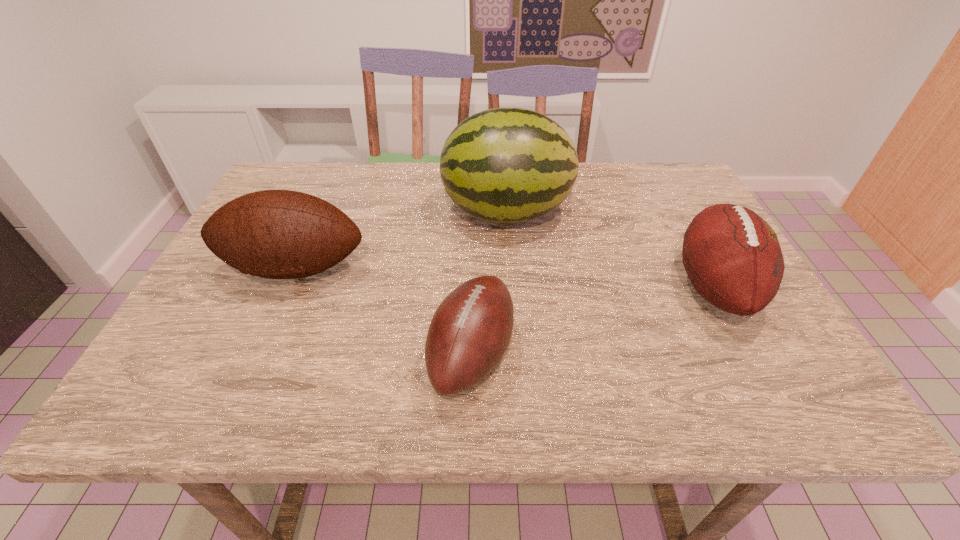
The image size is (960, 540). Find the location of `football (American) that can be found as the second closest to the second football (American) from left to right`. football (American) that can be found as the second closest to the second football (American) from left to right is located at coordinates tap(732, 256).

I want to click on football (American) that is the closest to the tallest object, so click(279, 234).

Identify the location of blank space that satisfies the following two spatial constraints: 1. on the laces of the second football (American) from left to right; 2. on the left side of the leftmost football (American). The height and width of the screenshot is (540, 960). (257, 354).

Where is `vacant space that satisfies the following two spatial constraints: 1. at the stem end of the tallest object; 2. on the laces of the leftmost object`? vacant space that satisfies the following two spatial constraints: 1. at the stem end of the tallest object; 2. on the laces of the leftmost object is located at coordinates (511, 268).

Locate an element on the screen. free spot that satisfies the following two spatial constraints: 1. on the laces of the leftmost object; 2. on the right side of the shortest football (American) is located at coordinates (257, 354).

You are a GUI agent. You are given a task and a screenshot of the screen. Output one action in this format:
    pyautogui.click(x=<x>, y=<y>)
    Task: Click on the free space that satisfies the following two spatial constraints: 1. at the stem end of the rightmost football (American); 2. on the right side of the tallest object
    
    Given the screenshot: What is the action you would take?
    pyautogui.click(x=512, y=287)

Image resolution: width=960 pixels, height=540 pixels. In order to click on free space that satisfies the following two spatial constraints: 1. at the stem end of the watermelon; 2. on the left side of the rightmost object in this screenshot , I will do `click(512, 287)`.

You are a GUI agent. You are given a task and a screenshot of the screen. Output one action in this format:
    pyautogui.click(x=<x>, y=<y>)
    Task: Click on the vacant area that satisfies the following two spatial constraints: 1. on the laces of the shortest football (American); 2. on the left side of the leftmost object
    This screenshot has height=540, width=960.
    Given the screenshot: What is the action you would take?
    pyautogui.click(x=257, y=354)

Identify the location of free location that satisfies the following two spatial constraints: 1. on the back side of the rightmost football (American); 2. on the left side of the shortest football (American). Image resolution: width=960 pixels, height=540 pixels. (472, 287).

Locate an element on the screen. The width and height of the screenshot is (960, 540). vacant position in the image that satisfies the following two spatial constraints: 1. on the laces of the rightmost football (American); 2. on the right side of the leftmost object is located at coordinates (287, 287).